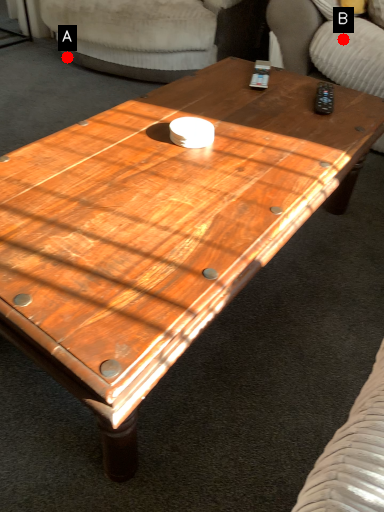
Question: Two points are circled on the image, labeled by A and B beside each circle. Which point appears farthest from the camera in this image?

Choices:
 (A) A is further
 (B) B is further

Answer: (A)